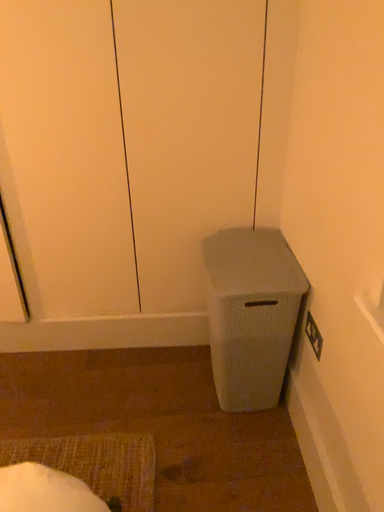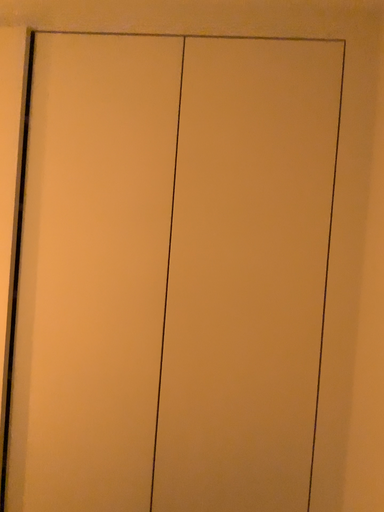
Question: How did the camera likely rotate when shooting the video?

Choices:
 (A) rotated upward
 (B) rotated downward

Answer: (A)